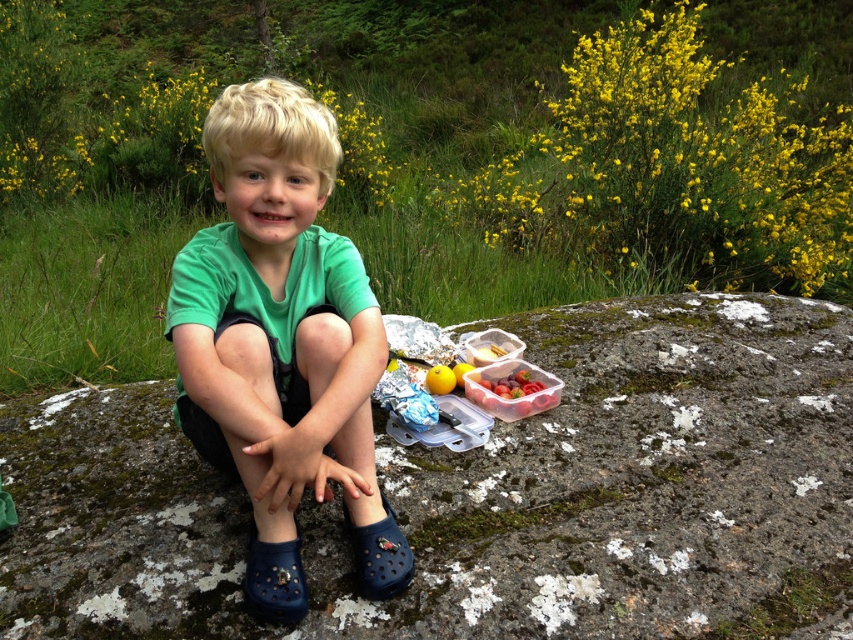
Question: Which point appears closest to the camera in this image?

Choices:
 (A) [442, 387]
 (B) [715, 304]

Answer: (A)

Question: Which object is farther from the camera taking this photo?

Choices:
 (A) yellow matte apple at center
 (B) green matte shirt at center
 (C) dark blue rubber clog at lower center

Answer: (A)

Question: Can you confirm if green matte shirt at center is positioned below blue rubber shoe at lower left?

Choices:
 (A) no
 (B) yes

Answer: (A)

Question: Among these objects, which one is farthest from the camera?

Choices:
 (A) yellow matte apple at center
 (B) gray mossy rock at center
 (C) blue rubber shoe at lower left

Answer: (A)

Question: Observing the image, what is the correct spatial positioning of gray mossy rock at center in reference to dark blue rubber clog at lower center?

Choices:
 (A) below
 (B) above

Answer: (B)

Question: Can you confirm if gray mossy rock at center is positioned above green matte shirt at center?

Choices:
 (A) yes
 (B) no

Answer: (B)